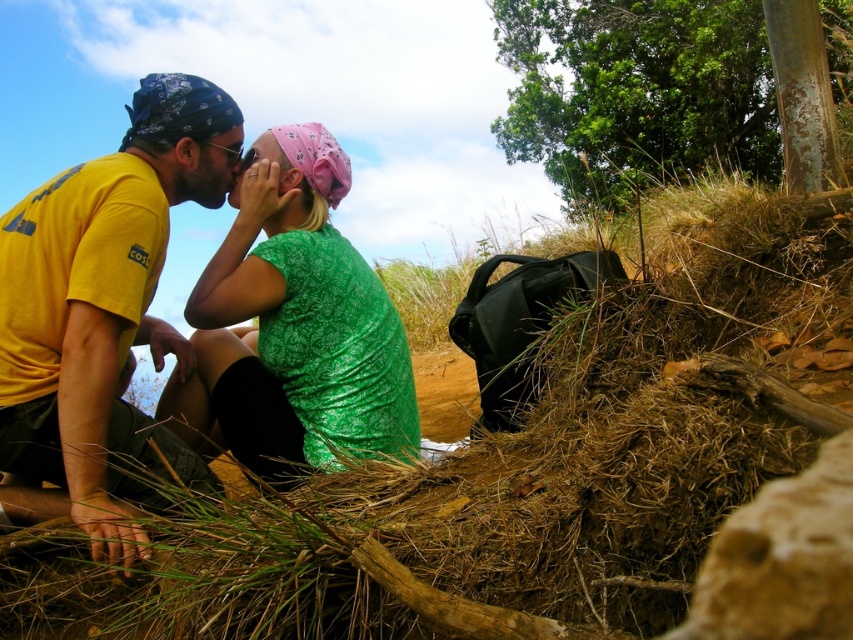
You are a photographer trying to capture the yellow matte tshirt at left. The camera you are using has a focal point set at coordinate point (106, 308). Will this focal point successfully capture the yellow matte tshirt at left?

Yes, the focal point at point (106, 308) is exactly where the yellow matte tshirt at left is located, so it will be captured successfully.